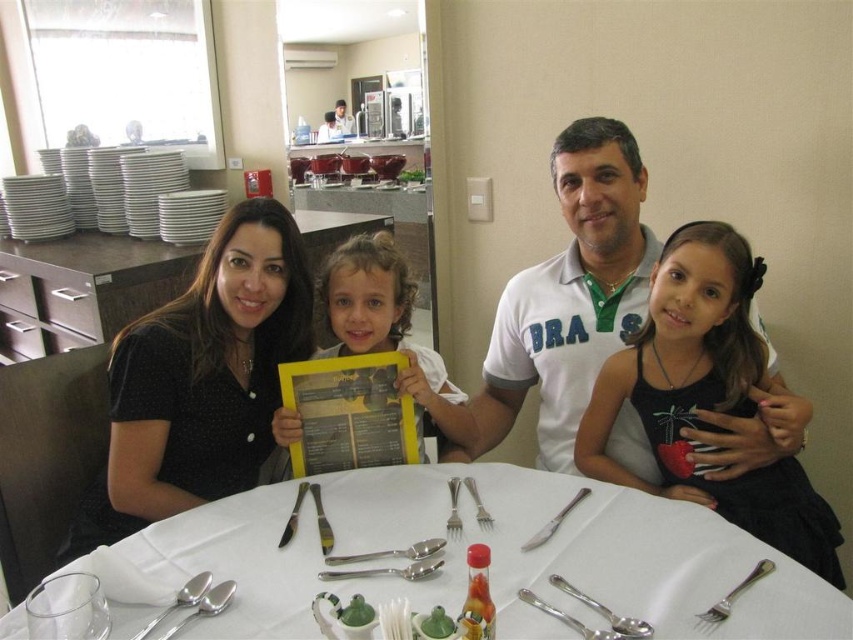
You are a waiter in a restaurant and need to place a new menu on the table. The current menu is the yellow paper menu at center. Where should you place the new menu so it doesn not block the polished silver spoon at center?

The yellow paper menu at center is to the left of the polished silver spoon at center, so placing the new menu to the right of the polished silver spoon at center would prevent it from blocking the spoon.

You are a waiter who needs to place a new plate at the dining table. The silver metallic fork at table is located at coordinate point (735, 593). Where should you place the plate relative to the silver metallic fork at table to follow proper table setting etiquette?

According to proper table setting etiquette, the plate should be placed directly above the silver metallic fork at table at coordinate point (735, 593).

You are a waiter at the restaurant and need to deliver a dessert menu to the customer wearing the black dotted dress at left. The dessert menu is currently placed near the satin silver fork at table center. Can you hand the dessert menu to the customer without moving the fork?

The black dotted dress at left is located above the satin silver fork at table center, so the customer wearing the black dotted dress at left is sitting above the fork. Since the dessert menu is near the fork, you can reach it without moving the fork and hand it to the customer.